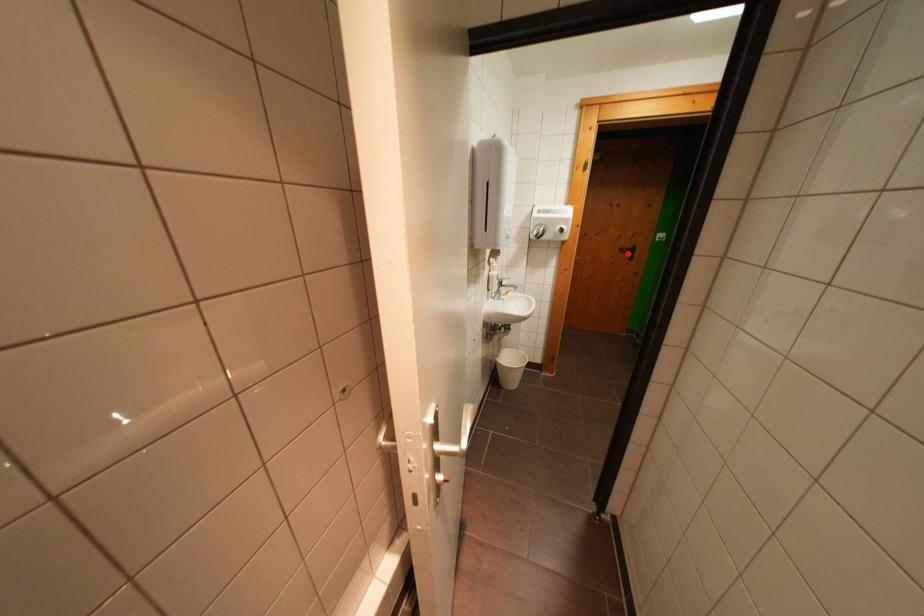
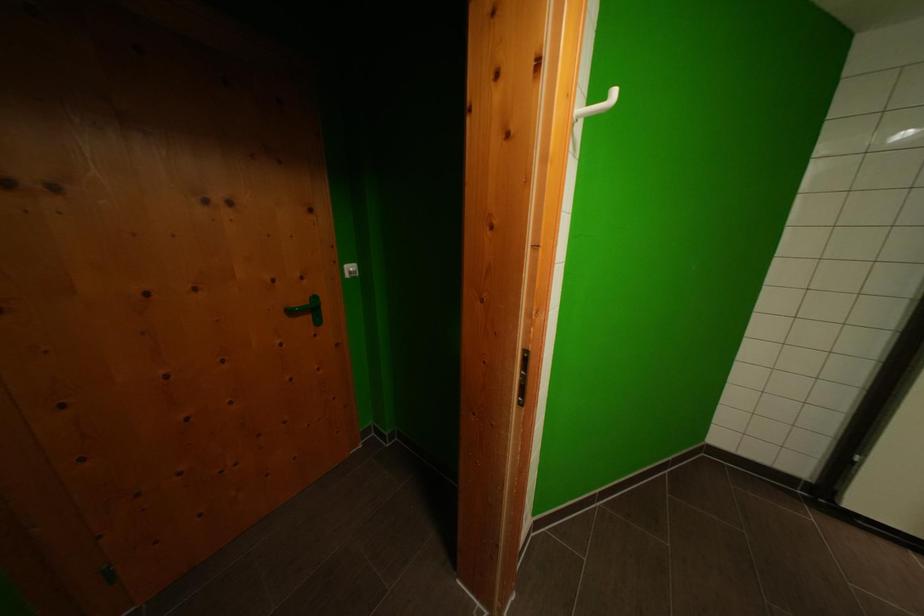
In the second image, find the point that corresponds to the highlighted location in the first image.

(297, 315)